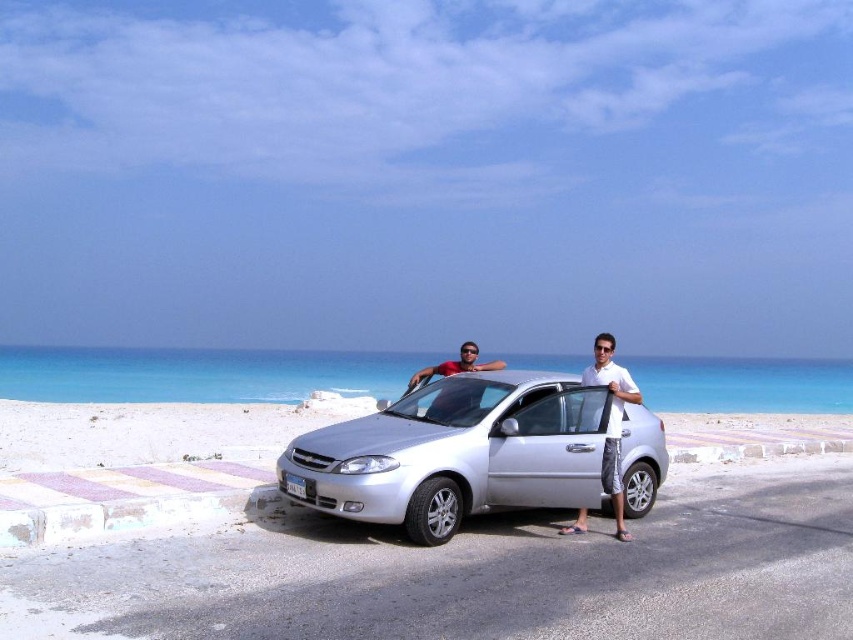
Can you confirm if silver metallic car at center is thinner than white cotton shirt at center?

No, silver metallic car at center is not thinner than white cotton shirt at center.

Find the location of a particular element. This screenshot has width=853, height=640. silver metallic car at center is located at coordinates (456, 452).

Who is lower down, white cotton shirt at center or matte black car at center?

Positioned lower is white cotton shirt at center.

What do you see at coordinates (612, 420) in the screenshot? I see `white cotton shirt at center` at bounding box center [612, 420].

The width and height of the screenshot is (853, 640). I want to click on white cotton shirt at center, so click(612, 420).

Is silver metallic car at center above matte black car at center?

Actually, silver metallic car at center is below matte black car at center.

Is silver metallic car at center wider than matte black car at center?

Correct, the width of silver metallic car at center exceeds that of matte black car at center.

Is point (440, 524) farther from viewer compared to point (485, 369)?

No, (440, 524) is in front of (485, 369).

The image size is (853, 640). In order to click on silver metallic car at center in this screenshot , I will do `click(456, 452)`.